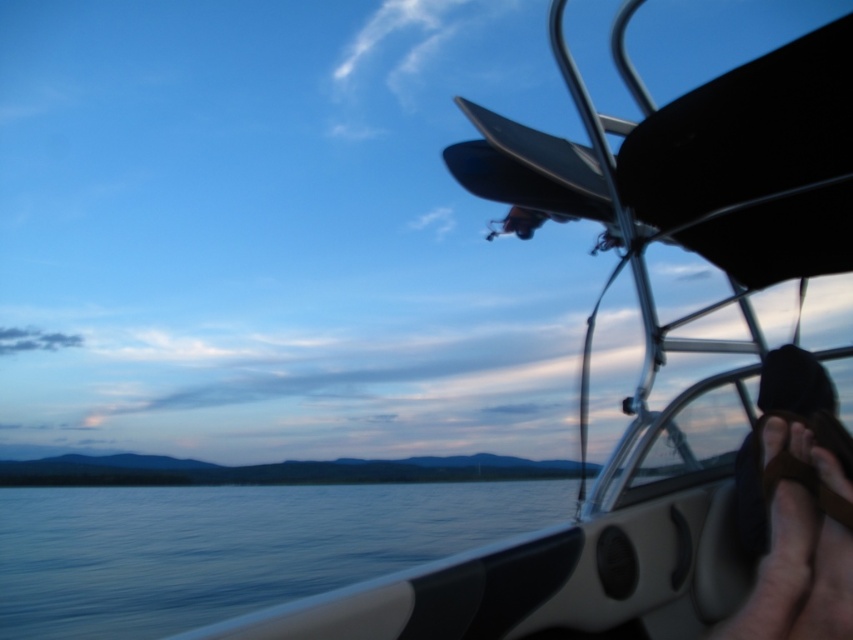
Question: Is smooth water at lower left to the right of black fabric cap at upper right from the viewer's perspective?

Choices:
 (A) no
 (B) yes

Answer: (A)

Question: Can you confirm if smooth water at lower left is positioned above black fabric cap at upper right?

Choices:
 (A) no
 (B) yes

Answer: (A)

Question: Which object is closer to the camera taking this photo?

Choices:
 (A) smooth water at lower left
 (B) black fabric cap at upper right

Answer: (B)

Question: Which point is farther from the camera taking this photo?

Choices:
 (A) (26, 589)
 (B) (840, 490)

Answer: (A)

Question: Can you confirm if smooth water at lower left is positioned above black fabric cap at upper right?

Choices:
 (A) no
 (B) yes

Answer: (A)